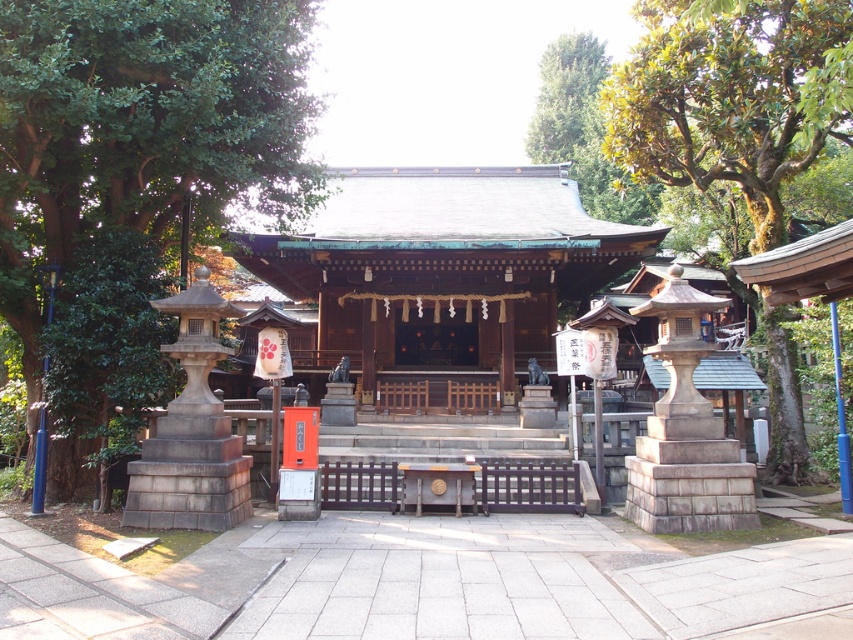
Is green leafy tree at left wider than green mossy tree at upper right?

Incorrect, green leafy tree at left's width does not surpass green mossy tree at upper right's.

Who is more distant from viewer, (264, 161) or (764, 177)?

Positioned behind is point (764, 177).

Does point (207, 92) lie behind point (772, 152)?

That is False.

Where is `green leafy tree at left`? This screenshot has height=640, width=853. green leafy tree at left is located at coordinates (134, 180).

Can you confirm if green leafy tree at left is positioned to the left of green leafy tree at upper center?

Yes, green leafy tree at left is to the left of green leafy tree at upper center.

Between point (252, 29) and point (553, 52), which one is positioned in front?

Positioned in front is point (252, 29).

Find the location of `green leafy tree at left`. green leafy tree at left is located at coordinates (134, 180).

In the scene shown: Which is below, green mossy tree at upper right or green leafy tree at upper center?

green mossy tree at upper right is below.

Is the position of green mossy tree at upper right less distant than that of green leafy tree at upper center?

That is True.

Who is more forward, (722, 134) or (628, 195)?

Point (722, 134)

The height and width of the screenshot is (640, 853). Identify the location of green mossy tree at upper right. (732, 97).